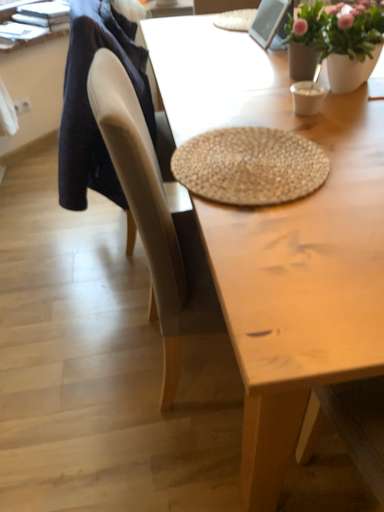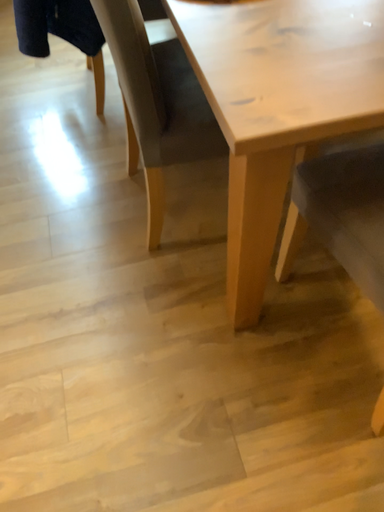
Question: How did the camera likely rotate when shooting the video?

Choices:
 (A) rotated downward
 (B) rotated upward

Answer: (A)